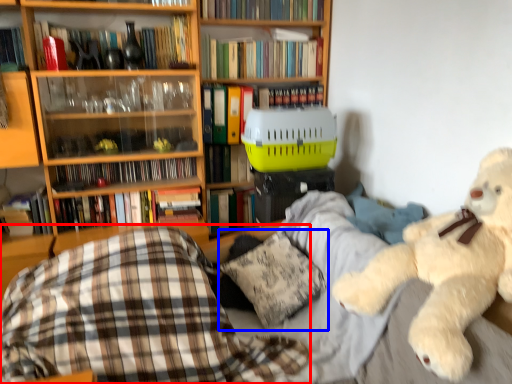
Question: Which object appears farthest to the camera in this image, plaid (highlighted by a red box) or pillow (highlighted by a blue box)?

Choices:
 (A) plaid
 (B) pillow

Answer: (B)